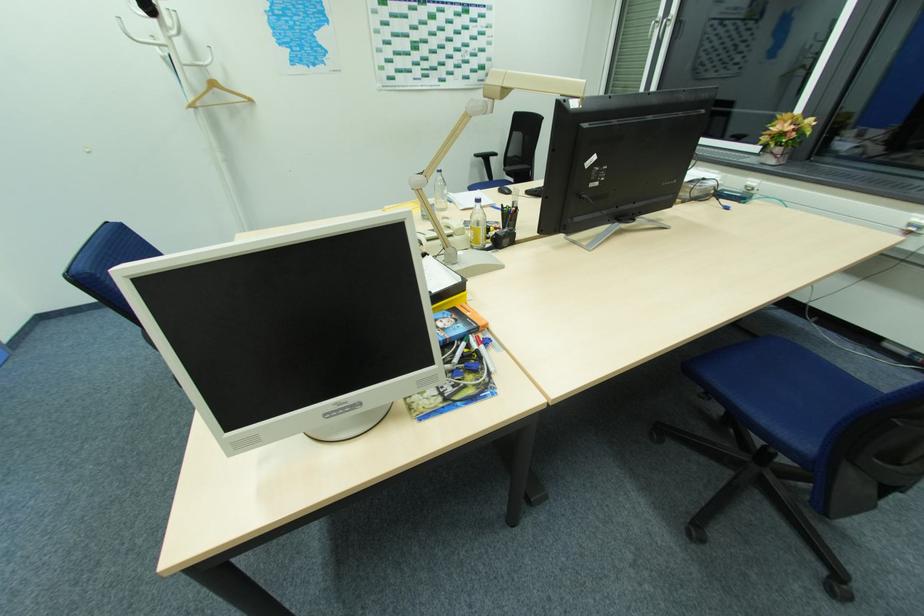
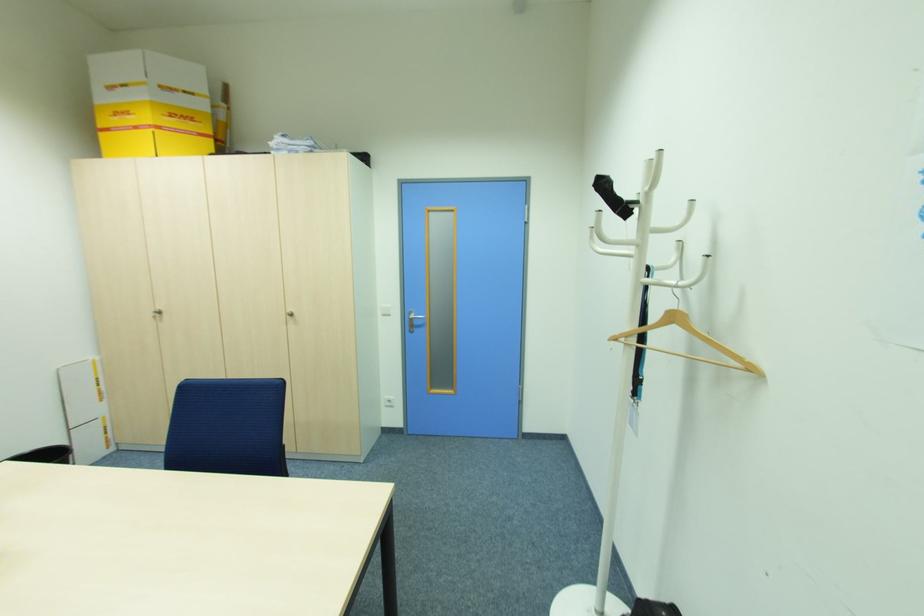
Locate, in the second image, the point that corresponds to point (253, 100) in the first image.

(756, 370)